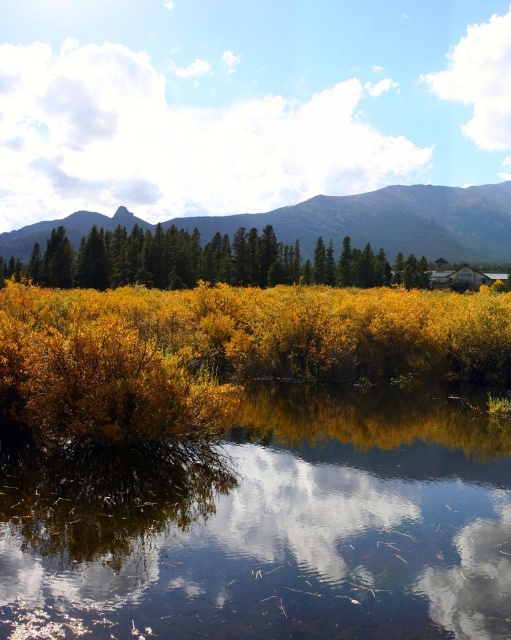
Does glossy reflective water at center have a lesser width compared to green matte trees at center?

Correct, glossy reflective water at center's width is less than green matte trees at center's.

Does glossy reflective water at center appear on the right side of green matte trees at center?

Indeed, glossy reflective water at center is positioned on the right side of green matte trees at center.

Describe the element at coordinates (285, 531) in the screenshot. I see `glossy reflective water at center` at that location.

You are a GUI agent. You are given a task and a screenshot of the screen. Output one action in this format:
    pyautogui.click(x=<x>, y=<y>)
    Task: Click on the glossy reflective water at center
    The width and height of the screenshot is (511, 640).
    Given the screenshot: What is the action you would take?
    pyautogui.click(x=285, y=531)

The height and width of the screenshot is (640, 511). What do you see at coordinates (285, 531) in the screenshot? I see `glossy reflective water at center` at bounding box center [285, 531].

Who is more distant from viewer, (x=69, y=564) or (x=445, y=198)?

The point (x=445, y=198) is more distant.

Where is `glossy reflective water at center`? Image resolution: width=511 pixels, height=640 pixels. glossy reflective water at center is located at coordinates (285, 531).

Is green matte trees at center bigger than rocky mountain at upper center?

Actually, green matte trees at center might be smaller than rocky mountain at upper center.

Who is more forward, (x=190, y=273) or (x=80, y=230)?

Positioned in front is point (x=190, y=273).

Is point (183, 253) in front of point (487, 205)?

Yes, it is.

Locate an element on the screen. green matte trees at center is located at coordinates (205, 260).